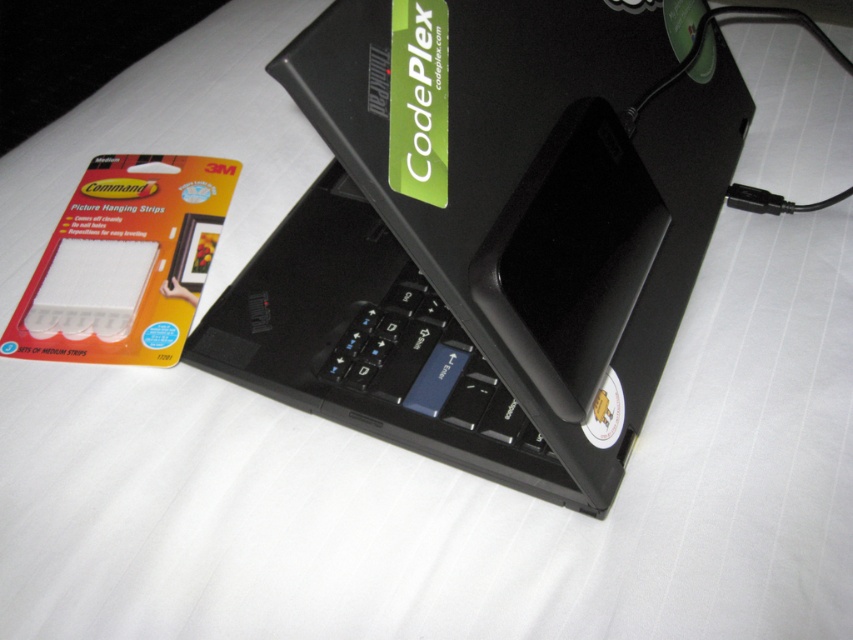
You are setting up a laptop on a desk and need to place the black plastic laptop at center and the black matte keyboard at center. According to the image, which one is closer to you?

The black plastic laptop at center is closer to you because it is in front of the black matte keyboard at center.

You are organizing your desk and want to place the black plastic laptop at center and the black matte keyboard at center so that they are aligned properly. According to the scene, which object should be moved to the left to achieve this alignment?

The black plastic laptop at center is currently to the right of the black matte keyboard at center. To align them properly, the black plastic laptop at center should be moved to the left so that it is positioned next to or aligned with the black matte keyboard at center.

You are looking at the image and want to determine which of the two points, point (352,301) or point (440,381), is closer to you. Based on the scene, which point is closer?

Point (352,301) is further to the viewer than point (440,381), so the closer point to you is point (440,381).